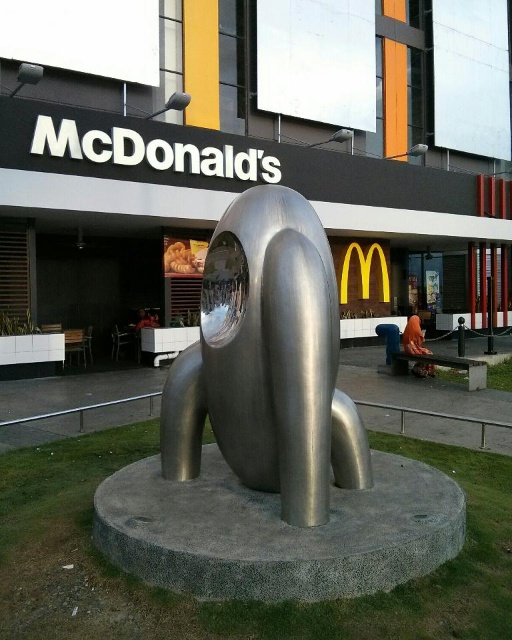
Which is behind, point (49, 317) or point (205, 324)?

Point (49, 317)

Does point (176, 292) come behind point (251, 353)?

Yes, it is.

Where is `polished stainless steel sculpture at center`? The width and height of the screenshot is (512, 640). polished stainless steel sculpture at center is located at coordinates (252, 147).